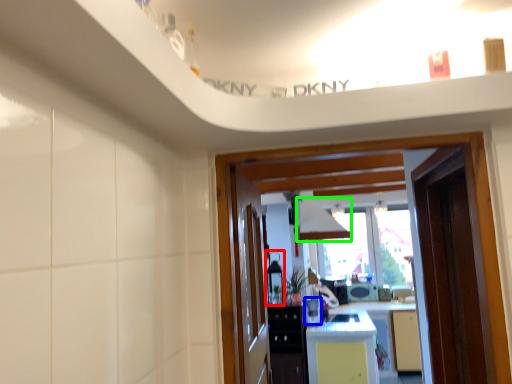
Question: Which is nearer to the appliance (highlighted by a red box)? appliance (highlighted by a blue box) or exhaust hood (highlighted by a green box).

Choices:
 (A) appliance
 (B) exhaust hood

Answer: (A)